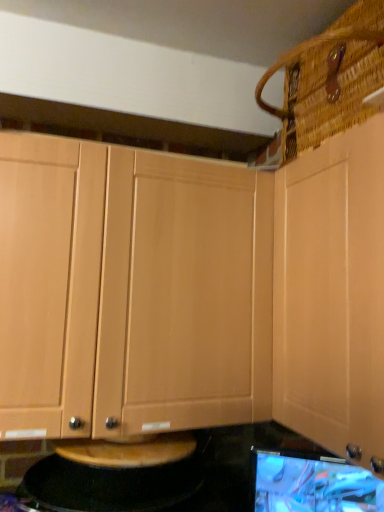
Where is `black granite countertop at lower center`? This screenshot has width=384, height=512. black granite countertop at lower center is located at coordinates (211, 478).

The width and height of the screenshot is (384, 512). Identify the location of woven brown basket at upper right. (329, 79).

Describe the element at coordinates (313, 484) in the screenshot. The image size is (384, 512). I see `matte black monitor at lower right` at that location.

The height and width of the screenshot is (512, 384). I want to click on black granite countertop at lower center, so click(x=211, y=478).

Considering the positions of objects light wood cabinet at center, the second cabinetry in the right-to-left sequence, and black granite countertop at lower center in the image provided, who is more to the left, light wood cabinet at center, the second cabinetry in the right-to-left sequence, or black granite countertop at lower center?

black granite countertop at lower center is more to the left.

Based on the photo, is light wood cabinet at center, the second cabinetry in the right-to-left sequence, not close to black granite countertop at lower center?

No, light wood cabinet at center, the second cabinetry in the right-to-left sequence, is in close proximity to black granite countertop at lower center.

You are a GUI agent. You are given a task and a screenshot of the screen. Output one action in this format:
    pyautogui.click(x=<x>, y=<y>)
    Task: Click on the 1st cabinetry above the black granite countertop at lower center (from the image's perspective)
    
    Given the screenshot: What is the action you would take?
    pyautogui.click(x=130, y=290)

Does light wood cabinet at center, which ranks as the 1th cabinetry in left-to-right order, have a greater width compared to black granite countertop at lower center?

No, light wood cabinet at center, which ranks as the 1th cabinetry in left-to-right order, is not wider than black granite countertop at lower center.

Considering the positions of points (353, 302) and (314, 41), is point (353, 302) farther from camera compared to point (314, 41)?

No.

Is light wood cabinet at upper right, which is the first cabinetry in right-to-left order, at the right side of woven brown basket at upper right?

Yes.

Is light wood cabinet at upper right, which is the first cabinetry in right-to-left order, outside of woven brown basket at upper right?

That's correct, light wood cabinet at upper right, which is the first cabinetry in right-to-left order, is outside of woven brown basket at upper right.

From the image's perspective, is black granite countertop at lower center located above or below matte black monitor at lower right?

black granite countertop at lower center is above matte black monitor at lower right.

Is matte black monitor at lower right at the back of black granite countertop at lower center?

No, black granite countertop at lower center is not facing away from matte black monitor at lower right.

Can you confirm if black granite countertop at lower center is thinner than matte black monitor at lower right?

No, black granite countertop at lower center is not thinner than matte black monitor at lower right.

Considering the relative sizes of black granite countertop at lower center and matte black monitor at lower right in the image provided, is black granite countertop at lower center smaller than matte black monitor at lower right?

Actually, black granite countertop at lower center might be larger than matte black monitor at lower right.

Which object is positioned more to the right, light wood cabinet at upper right, the second cabinetry viewed from the left, or light wood cabinet at center, which ranks as the 1th cabinetry in left-to-right order?

From the viewer's perspective, light wood cabinet at upper right, the second cabinetry viewed from the left, appears more on the right side.

In the scene shown: Can you tell me how much light wood cabinet at upper right, the second cabinetry viewed from the left, and light wood cabinet at center, which ranks as the 1th cabinetry in left-to-right order, differ in facing direction?

The angle between the facing direction of light wood cabinet at upper right, the second cabinetry viewed from the left, and the facing direction of light wood cabinet at center, which ranks as the 1th cabinetry in left-to-right order, is 90 degrees.

Can you confirm if light wood cabinet at upper right, which is the first cabinetry in right-to-left order, is wider than light wood cabinet at center, which ranks as the 1th cabinetry in left-to-right order?

Yes.

Is light wood cabinet at center, the second cabinetry in the right-to-left sequence, at the back of light wood cabinet at upper right, which is the first cabinetry in right-to-left order?

No, light wood cabinet at upper right, which is the first cabinetry in right-to-left order, is not facing the opposite direction of light wood cabinet at center, the second cabinetry in the right-to-left sequence.

In the image, is light wood cabinet at center, the second cabinetry in the right-to-left sequence, positioned in front of or behind light wood cabinet at upper right, which is the first cabinetry in right-to-left order?

Visually, light wood cabinet at center, the second cabinetry in the right-to-left sequence, is located behind light wood cabinet at upper right, which is the first cabinetry in right-to-left order.

Is light wood cabinet at center, the second cabinetry in the right-to-left sequence, facing towards light wood cabinet at upper right, the second cabinetry viewed from the left?

No, light wood cabinet at center, the second cabinetry in the right-to-left sequence, does not turn towards light wood cabinet at upper right, the second cabinetry viewed from the left.

Is light wood cabinet at upper right, the second cabinetry viewed from the left, surrounded by light wood cabinet at center, which ranks as the 1th cabinetry in left-to-right order?

No, light wood cabinet at upper right, the second cabinetry viewed from the left, is not inside light wood cabinet at center, which ranks as the 1th cabinetry in left-to-right order.

Between light wood cabinet at center, the second cabinetry in the right-to-left sequence, and light wood cabinet at upper right, the second cabinetry viewed from the left, which one has smaller width?

Thinner between the two is light wood cabinet at center, the second cabinetry in the right-to-left sequence.

Is light wood cabinet at upper right, the second cabinetry viewed from the left, bigger or smaller than black granite countertop at lower center?

light wood cabinet at upper right, the second cabinetry viewed from the left, is bigger than black granite countertop at lower center.

From the image's perspective, which is below, light wood cabinet at upper right, which is the first cabinetry in right-to-left order, or black granite countertop at lower center?

black granite countertop at lower center appears lower in the image.

This screenshot has height=512, width=384. Identify the location of counter top behind the light wood cabinet at upper right, the second cabinetry viewed from the left. (211, 478).

Can you confirm if woven brown basket at upper right is bigger than light wood cabinet at upper right, the second cabinetry viewed from the left?

Actually, woven brown basket at upper right might be smaller than light wood cabinet at upper right, the second cabinetry viewed from the left.

Is woven brown basket at upper right touching light wood cabinet at upper right, which is the first cabinetry in right-to-left order?

woven brown basket at upper right and light wood cabinet at upper right, which is the first cabinetry in right-to-left order, are not in contact.

This screenshot has height=512, width=384. Identify the location of basket on the left of light wood cabinet at upper right, the second cabinetry viewed from the left. (329, 79).

From the image's perspective, starting from the black granite countertop at lower center, which cabinetry is the 1st one above? Please provide its 2D coordinates.

[(130, 290)]

Find the location of a particular element. This screenshot has width=384, height=512. basket behind the light wood cabinet at upper right, the second cabinetry viewed from the left is located at coordinates (329, 79).

Looking at the image, which one is located further to matte black monitor at lower right, light wood cabinet at center, the second cabinetry in the right-to-left sequence, or black granite countertop at lower center?

light wood cabinet at center, the second cabinetry in the right-to-left sequence, lies further to matte black monitor at lower right than the other object.

Looking at the image, which one is located closer to black granite countertop at lower center, light wood cabinet at center, which ranks as the 1th cabinetry in left-to-right order, or matte black monitor at lower right?

matte black monitor at lower right is positioned closer to the anchor black granite countertop at lower center.

Which object lies nearer to the anchor point light wood cabinet at upper right, which is the first cabinetry in right-to-left order, black granite countertop at lower center or matte black monitor at lower right?

matte black monitor at lower right is closer to light wood cabinet at upper right, which is the first cabinetry in right-to-left order.

Considering their positions, is light wood cabinet at center, the second cabinetry in the right-to-left sequence, positioned closer to matte black monitor at lower right than light wood cabinet at upper right, which is the first cabinetry in right-to-left order?

light wood cabinet at upper right, which is the first cabinetry in right-to-left order.

Considering their positions, is light wood cabinet at center, the second cabinetry in the right-to-left sequence, positioned closer to light wood cabinet at upper right, which is the first cabinetry in right-to-left order, than woven brown basket at upper right?

woven brown basket at upper right.

Estimate the real-world distances between objects in this image. Which object is further from light wood cabinet at upper right, which is the first cabinetry in right-to-left order, woven brown basket at upper right or black granite countertop at lower center?

Based on the image, black granite countertop at lower center appears to be further to light wood cabinet at upper right, which is the first cabinetry in right-to-left order.

When comparing their distances from matte black monitor at lower right, does black granite countertop at lower center or woven brown basket at upper right seem further?

The object further to matte black monitor at lower right is woven brown basket at upper right.

Based on their spatial positions, is light wood cabinet at upper right, the second cabinetry viewed from the left, or woven brown basket at upper right closer to light wood cabinet at center, which ranks as the 1th cabinetry in left-to-right order?

light wood cabinet at upper right, the second cabinetry viewed from the left, lies closer to light wood cabinet at center, which ranks as the 1th cabinetry in left-to-right order, than the other object.

Find the location of `counter top between woven brown basket at upper right and matte black monitor at lower right vertically`. counter top between woven brown basket at upper right and matte black monitor at lower right vertically is located at coordinates (211, 478).

Where is `cabinetry between black granite countertop at lower center and light wood cabinet at upper right, which is the first cabinetry in right-to-left order`? The width and height of the screenshot is (384, 512). cabinetry between black granite countertop at lower center and light wood cabinet at upper right, which is the first cabinetry in right-to-left order is located at coordinates (130, 290).

This screenshot has height=512, width=384. In order to click on cabinetry situated between black granite countertop at lower center and matte black monitor at lower right from left to right in this screenshot , I will do `click(130, 290)`.

The height and width of the screenshot is (512, 384). Identify the location of basket between light wood cabinet at center, the second cabinetry in the right-to-left sequence, and light wood cabinet at upper right, which is the first cabinetry in right-to-left order, from left to right. (329, 79).